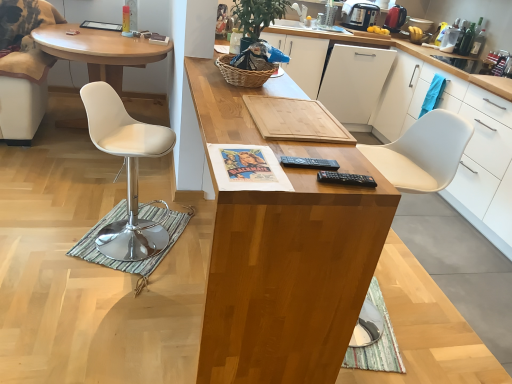
Image resolution: width=512 pixels, height=384 pixels. Find the location of `vacant space to the right of wooden at center, the 1th desk in the right-to-left sequence`. vacant space to the right of wooden at center, the 1th desk in the right-to-left sequence is located at coordinates (433, 294).